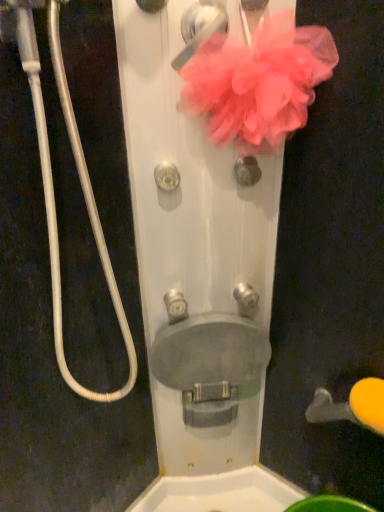
The height and width of the screenshot is (512, 384). In order to click on pink fabric door handle at upper center, the second door handle from the back in this screenshot , I will do `click(200, 28)`.

What do you see at coordinates (167, 177) in the screenshot? This screenshot has width=384, height=512. I see `metallic silver knob at center, which is the 1th knob in left-to-right order` at bounding box center [167, 177].

Find the location of a particular element. The height and width of the screenshot is (512, 384). metallic silver knob at center, arranged as the second knob when viewed from the left is located at coordinates (175, 306).

At what (x,y) coordinates should I click in order to perform the action: click on yellow rubber door handle at lower right, positioned as the first door handle in back-to-front order. Please return your answer as a coordinate pair (x, y). This screenshot has height=512, width=384. Looking at the image, I should click on (352, 406).

In order to face metallic knob at center, positioned as the second knob in right-to-left order, should I rotate leftwards or rightwards?

To align with it, rotate right about 7.604°.

The image size is (384, 512). I want to click on metallic knob at center, placed as the third knob when sorted from left to right, so click(x=247, y=170).

The image size is (384, 512). Find the location of `pink fabric door handle at upper center, the 2th door handle positioned from the bottom`. pink fabric door handle at upper center, the 2th door handle positioned from the bottom is located at coordinates (200, 28).

Looking at this image, do you think metallic silver knob at center, the 3th knob positioned from the right, is within satin silver knob at center, arranged as the 2th knob when ordered from the bottom, or outside of it?

metallic silver knob at center, the 3th knob positioned from the right, cannot be found inside satin silver knob at center, arranged as the 2th knob when ordered from the bottom.

In the image, is metallic silver knob at center, the 3th knob positioned from the right, positioned in front of or behind satin silver knob at center, the 3th knob positioned from the top?

metallic silver knob at center, the 3th knob positioned from the right, is in front of satin silver knob at center, the 3th knob positioned from the top.

Does point (172, 304) come behind point (244, 305)?

That is False.

From the image's perspective, who appears lower, metallic silver knob at center, which is counted as the 1th knob, starting from the bottom, or satin silver knob at center, the 3th knob positioned from the top?

From the image's view, metallic silver knob at center, which is counted as the 1th knob, starting from the bottom, is below.

Which is more distant, (234, 292) or (274, 33)?

Positioned behind is point (234, 292).

Is satin silver knob at center, the 4th knob from the left, oriented away from pink mesh flower at upper center?

satin silver knob at center, the 4th knob from the left, does not have its back to pink mesh flower at upper center.

In the scene shown: Is satin silver knob at center, the 4th knob from the left, wider than pink mesh flower at upper center?

No, satin silver knob at center, the 4th knob from the left, is not wider than pink mesh flower at upper center.

How much distance is there between satin silver knob at center, the 4th knob from the left, and pink mesh flower at upper center?

satin silver knob at center, the 4th knob from the left, is 17.41 inches away from pink mesh flower at upper center.

Where is `the 1st door handle in front of the satin silver knob at center, the 3th knob positioned from the top`? the 1st door handle in front of the satin silver knob at center, the 3th knob positioned from the top is located at coordinates (352, 406).

Does point (243, 296) appear closer or farther from the camera than point (375, 415)?

Clearly, point (243, 296) is more distant from the camera than point (375, 415).

Which of these two, satin silver knob at center, arranged as the 2th knob when ordered from the bottom, or yellow rubber door handle at lower right, positioned as the first door handle in back-to-front order, is wider?

Wider between the two is yellow rubber door handle at lower right, positioned as the first door handle in back-to-front order.

Is satin silver knob at center, arranged as the 2th knob when ordered from the bottom, inside the boundaries of yellow rubber door handle at lower right, which is counted as the first door handle, starting from the right, or outside?

satin silver knob at center, arranged as the 2th knob when ordered from the bottom, exists outside the volume of yellow rubber door handle at lower right, which is counted as the first door handle, starting from the right.

Are satin silver knob at center, the 4th knob from the left, and metallic silver knob at center, which is the fourth knob from right to left, located far from each other?

No, satin silver knob at center, the 4th knob from the left, is not far away from metallic silver knob at center, which is the fourth knob from right to left.

From a real-world perspective, is satin silver knob at center, arranged as the 2th knob when ordered from the bottom, on top of metallic silver knob at center, which is the fourth knob from right to left?

No.

Is satin silver knob at center, the 4th knob from the left, thinner than metallic silver knob at center, which is the third knob from bottom to top?

Incorrect, the width of satin silver knob at center, the 4th knob from the left, is not less than that of metallic silver knob at center, which is the third knob from bottom to top.

Which of these two, pink mesh flower at upper center or satin silver knob at center, the 3th knob positioned from the top, is thinner?

satin silver knob at center, the 3th knob positioned from the top, is thinner.

Does pink mesh flower at upper center have a smaller size compared to satin silver knob at center, arranged as the 2th knob when ordered from the bottom?

Actually, pink mesh flower at upper center might be larger than satin silver knob at center, arranged as the 2th knob when ordered from the bottom.

Considering the positions of objects pink mesh flower at upper center and satin silver knob at center, the 4th knob from the left, in the image provided, who is more to the left, pink mesh flower at upper center or satin silver knob at center, the 4th knob from the left,?

From the viewer's perspective, pink mesh flower at upper center appears more on the left side.

Which of these two, pink mesh flower at upper center or satin silver knob at center, the 4th knob from the left, stands shorter?

Standing shorter between the two is satin silver knob at center, the 4th knob from the left.

From the metallic silver knob at center, which is the fourth knob from right to left, count 2nd knobs backward and point to it. Please provide its 2D coordinates.

[(175, 306)]

Is metallic silver knob at center, which is the 1th knob in left-to-right order, not inside metallic silver knob at center, the 3th knob positioned from the right?

Yes, metallic silver knob at center, which is the 1th knob in left-to-right order, is located beyond the bounds of metallic silver knob at center, the 3th knob positioned from the right.

Is metallic silver knob at center, which is the 1th knob in left-to-right order, in front of metallic silver knob at center, the 3th knob positioned from the right?

Yes, metallic silver knob at center, which is the 1th knob in left-to-right order, is in front of metallic silver knob at center, the 3th knob positioned from the right.

From a real-world perspective, which is physically above, metallic silver knob at center, which is the third knob from bottom to top, or metallic silver knob at center, arranged as the second knob when viewed from the left?

metallic silver knob at center, which is the third knob from bottom to top, from a real-world perspective.

Is metallic silver knob at center, arranged as the second knob when viewed from the left, positioned far away from metallic knob at center, placed as the third knob when sorted from left to right?

metallic silver knob at center, arranged as the second knob when viewed from the left, is near metallic knob at center, placed as the third knob when sorted from left to right, not far away.

Is metallic silver knob at center, the 3th knob positioned from the right, completely or partially outside of metallic knob at center, positioned as the second knob in right-to-left order?

Yes, metallic silver knob at center, the 3th knob positioned from the right, is not within metallic knob at center, positioned as the second knob in right-to-left order.

How different are the orientations of metallic silver knob at center, which is counted as the 1th knob, starting from the bottom, and metallic knob at center, positioned as the second knob in right-to-left order, in degrees?

0.00312 degrees.

Can you confirm if metallic silver knob at center, arranged as the second knob when viewed from the left, is positioned to the right of metallic knob at center, positioned as the second knob in right-to-left order?

In fact, metallic silver knob at center, arranged as the second knob when viewed from the left, is to the left of metallic knob at center, positioned as the second knob in right-to-left order.

Find the location of a particular element. This screenshot has height=512, width=384. the 2nd knob to the right when counting from the metallic silver knob at center, the 3th knob positioned from the right is located at coordinates (246, 297).

Image resolution: width=384 pixels, height=512 pixels. I want to click on the 3rd knob positioned below the pink mesh flower at upper center (from the image's perspective), so click(x=246, y=297).

Which object lies nearer to the anchor point pink mesh flower at upper center, pink fabric door handle at upper center, positioned as the 1th door handle in top-to-bottom order, or satin silver knob at center, the 4th knob from the left?

Based on the image, pink fabric door handle at upper center, positioned as the 1th door handle in top-to-bottom order, appears to be nearer to pink mesh flower at upper center.

From the image, which object appears to be nearer to yellow rubber door handle at lower right, acting as the second door handle starting from the top, metallic knob at center, the fourth knob in the bottom-to-top sequence, or metallic silver knob at center, the 3th knob positioned from the right?

The object closer to yellow rubber door handle at lower right, acting as the second door handle starting from the top, is metallic silver knob at center, the 3th knob positioned from the right.

Looking at the image, which one is located closer to metallic knob at center, positioned as the second knob in right-to-left order, metallic silver knob at center, which is the 1th knob in left-to-right order, or metallic silver knob at center, arranged as the second knob when viewed from the left?

Based on the image, metallic silver knob at center, which is the 1th knob in left-to-right order, appears to be nearer to metallic knob at center, positioned as the second knob in right-to-left order.

From the image, which object appears to be nearer to pink fabric door handle at upper center, which appears as the first door handle when viewed from the left, metallic silver knob at center, arranged as the second knob when viewed from the left, or metallic silver knob at center, placed as the second knob when sorted from top to bottom?

metallic silver knob at center, placed as the second knob when sorted from top to bottom, is positioned closer to the anchor pink fabric door handle at upper center, which appears as the first door handle when viewed from the left.

Which object lies further to the anchor point metallic silver knob at center, the 3th knob positioned from the right, metallic knob at center, the fourth knob in the bottom-to-top sequence, or pink mesh flower at upper center?

pink mesh flower at upper center is further to metallic silver knob at center, the 3th knob positioned from the right.

Looking at the image, which one is located further to pink mesh flower at upper center, yellow rubber door handle at lower right, the second door handle in the left-to-right sequence, or metallic silver knob at center, arranged as the second knob when viewed from the left?

Among the two, yellow rubber door handle at lower right, the second door handle in the left-to-right sequence, is located further to pink mesh flower at upper center.

From the image, which object appears to be nearer to pink fabric door handle at upper center, the first door handle viewed from the front, yellow rubber door handle at lower right, arranged as the 1th door handle when ordered from the bottom, or metallic silver knob at center, the 3th knob positioned from the right?

Among the two, metallic silver knob at center, the 3th knob positioned from the right, is located nearer to pink fabric door handle at upper center, the first door handle viewed from the front.

Based on their spatial positions, is pink fabric door handle at upper center, positioned as the 1th door handle in top-to-bottom order, or metallic silver knob at center, which is counted as the 1th knob, starting from the bottom, further from yellow rubber door handle at lower right, the second door handle in the left-to-right sequence?

pink fabric door handle at upper center, positioned as the 1th door handle in top-to-bottom order.

This screenshot has height=512, width=384. Identify the location of flower between pink fabric door handle at upper center, positioned as the 1th door handle in top-to-bottom order, and metallic silver knob at center, the 3th knob positioned from the right, in the up-down direction. (258, 82).

The height and width of the screenshot is (512, 384). Identify the location of knob positioned between pink mesh flower at upper center and metallic knob at center, the fourth knob in the bottom-to-top sequence, from near to far. (167, 177).

Where is `knob between metallic silver knob at center, placed as the second knob when sorted from top to bottom, and metallic silver knob at center, arranged as the second knob when viewed from the left, vertically`? Image resolution: width=384 pixels, height=512 pixels. knob between metallic silver knob at center, placed as the second knob when sorted from top to bottom, and metallic silver knob at center, arranged as the second knob when viewed from the left, vertically is located at coordinates (246, 297).

This screenshot has width=384, height=512. I want to click on flower between pink fabric door handle at upper center, positioned as the 1th door handle in top-to-bottom order, and satin silver knob at center, the 3th knob positioned from the top, in the up-down direction, so click(258, 82).